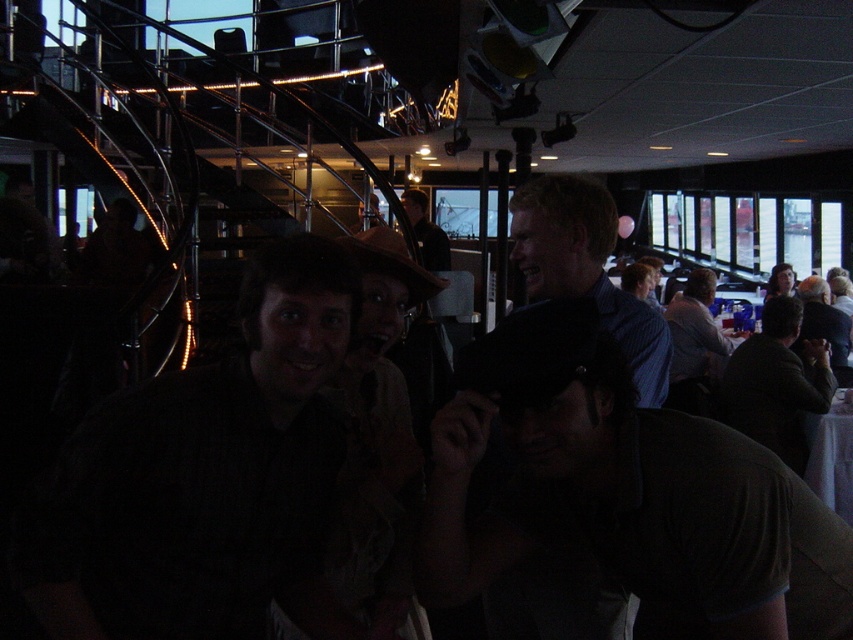
You are standing in the middle of the room and want to greet both people wearing dark brown leather jackets. Which direction should you walk to first reach the dark brown leather jacket at upper center and then the dark brown leather jacket at right?

First walk towards the dark brown leather jacket at upper center, then move downward to reach the dark brown leather jacket at right since it is located below the upper center one.